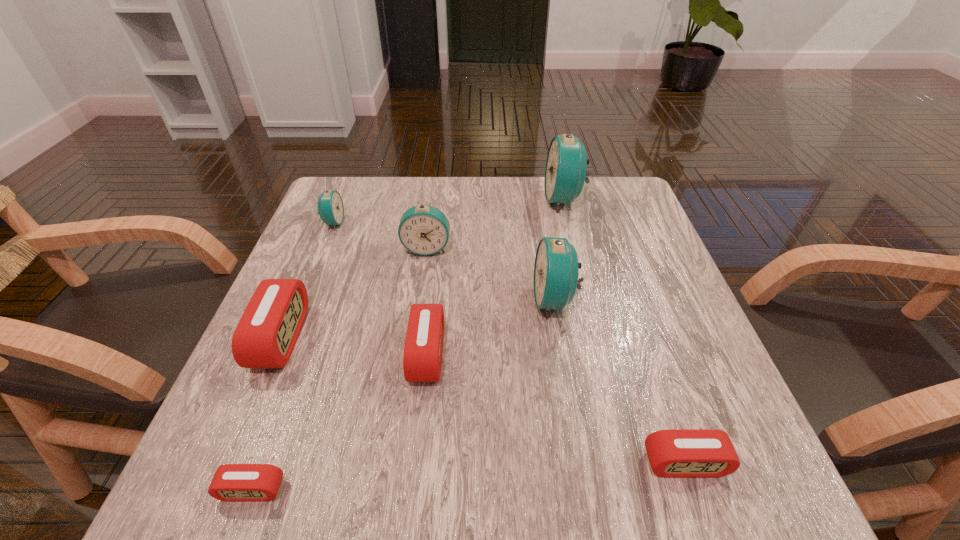
Identify the location of free space between the sixth shortest object and the biggest blue alarm clock. (495, 224).

At what (x,y) coordinates should I click in order to perform the action: click on object that is the closest to the shortest alarm clock. Please return your answer as a coordinate pair (x, y). The image size is (960, 540). Looking at the image, I should click on (265, 336).

The height and width of the screenshot is (540, 960). Identify the location of the third closest object to the second tallest alarm clock. (565, 172).

You are a GUI agent. You are given a task and a screenshot of the screen. Output one action in this format:
    pyautogui.click(x=<x>, y=<y>)
    Task: Click on the second closest alarm clock to the seventh shortest object
    
    Given the screenshot: What is the action you would take?
    pos(424,230)

What are the coordinates of `the fourth closest alarm clock relative to the biggest pink alarm clock` in the screenshot? It's located at (330, 209).

The height and width of the screenshot is (540, 960). What are the coordinates of `blue alarm clock that is the closest to the second blue alarm clock from left to right` in the screenshot? It's located at (330, 209).

Identify the location of blue alarm clock that is the second closest to the biggest pink alarm clock. (330, 209).

Find the location of a particular element. the second closest pink alarm clock to the second shortest alarm clock is located at coordinates (232, 482).

At what (x,y) coordinates should I click in order to perform the action: click on pink alarm clock that is the second closest to the biggest pink alarm clock. Please return your answer as a coordinate pair (x, y). This screenshot has width=960, height=540. Looking at the image, I should click on (422, 360).